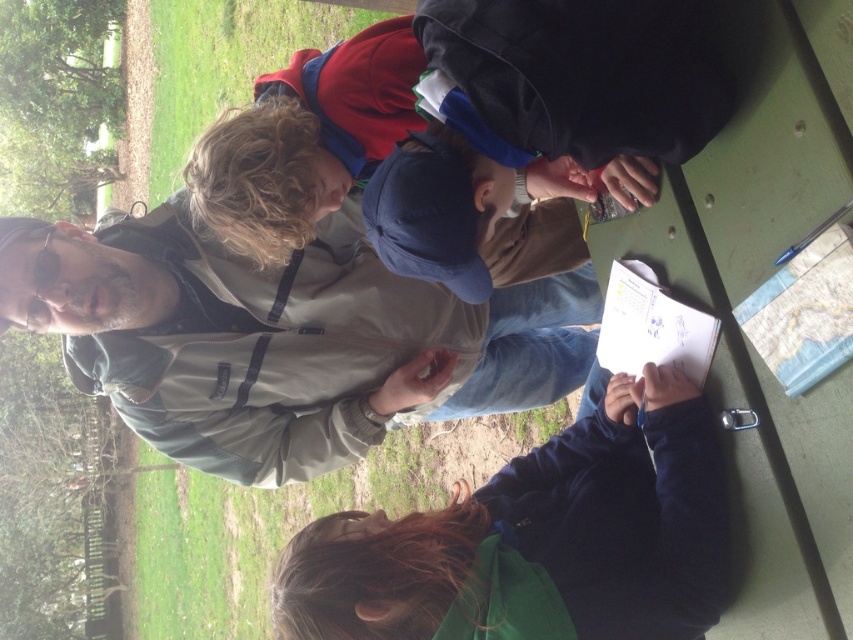
You are standing at the position of the camera. The gray fabric jacket at upper left and the dark brown hair at lower center are both in your view. How far apart are these two objects?

The gray fabric jacket at upper left is 1.14 meters from dark brown hair at lower center.